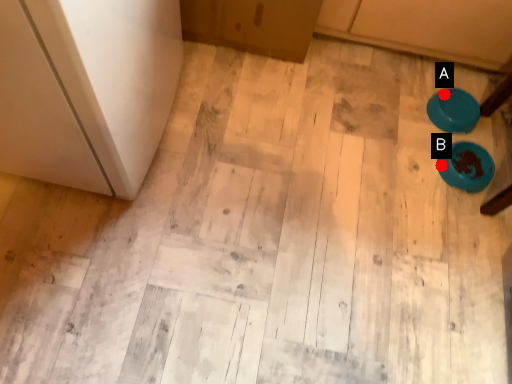
Question: Two points are circled on the image, labeled by A and B beside each circle. Which point is further to the camera?

Choices:
 (A) A is further
 (B) B is further

Answer: (A)